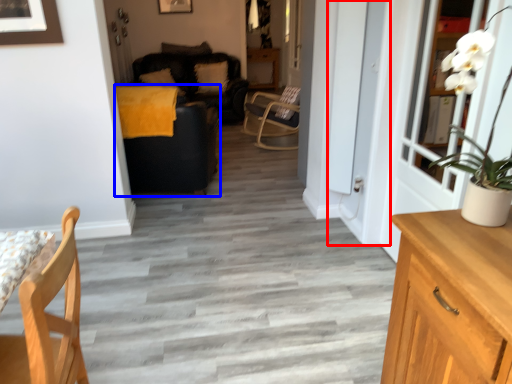
Question: Which object appears closest to the camera in this image, screen door (highlighted by a red box) or studio couch (highlighted by a blue box)?

Choices:
 (A) screen door
 (B) studio couch

Answer: (A)